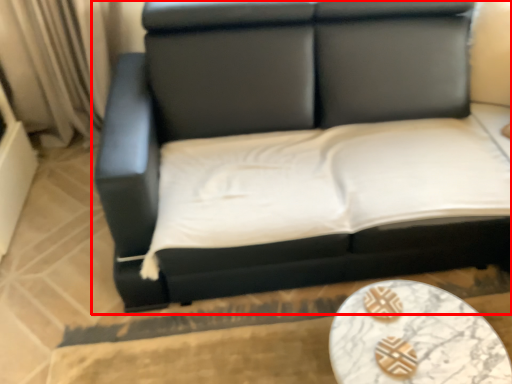
Question: From the image's perspective, what is the correct spatial relationship of studio couch (annotated by the red box) in relation to table?

Choices:
 (A) above
 (B) below

Answer: (A)